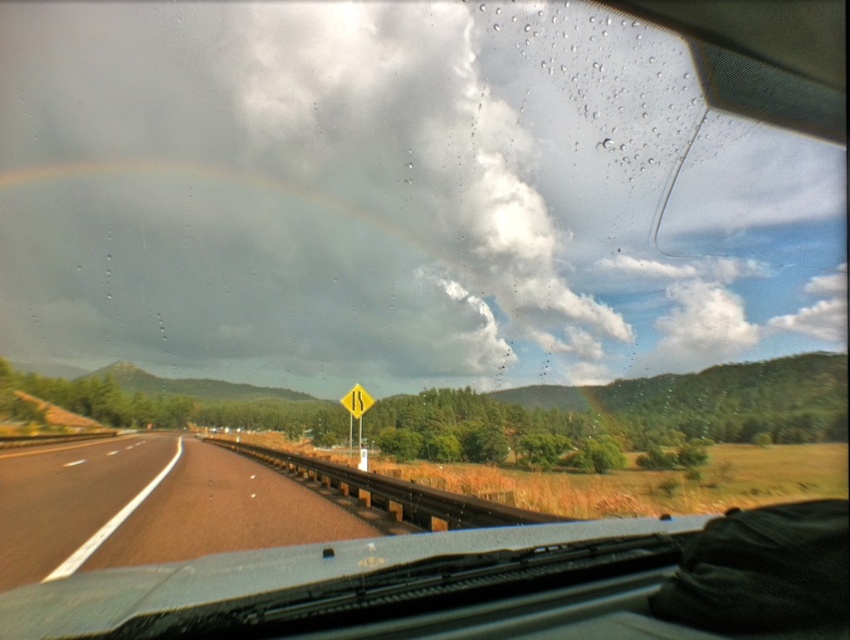
Who is lower down, white fluffy cloud at upper center or yellow reflective plastic at center?

yellow reflective plastic at center is below.

Does white fluffy cloud at upper center have a smaller size compared to yellow reflective plastic at center?

Incorrect, white fluffy cloud at upper center is not smaller in size than yellow reflective plastic at center.

Identify the location of white fluffy cloud at upper center. The image size is (850, 640). (275, 195).

I want to click on white fluffy cloud at upper center, so coord(275,195).

Who is positioned more to the right, brown asphalt highway at center or yellow reflective plastic at center?

yellow reflective plastic at center is more to the right.

Does point (476, 509) come farther from viewer compared to point (360, 388)?

No, it is not.

I want to click on brown asphalt highway at center, so click(204, 504).

Is white fluffy cloud at upper center wider than brown asphalt highway at center?

Indeed, white fluffy cloud at upper center has a greater width compared to brown asphalt highway at center.

Between white fluffy cloud at upper center and brown asphalt highway at center, which one appears on the left side from the viewer's perspective?

Positioned to the left is white fluffy cloud at upper center.

The height and width of the screenshot is (640, 850). In order to click on white fluffy cloud at upper center in this screenshot , I will do `click(275, 195)`.